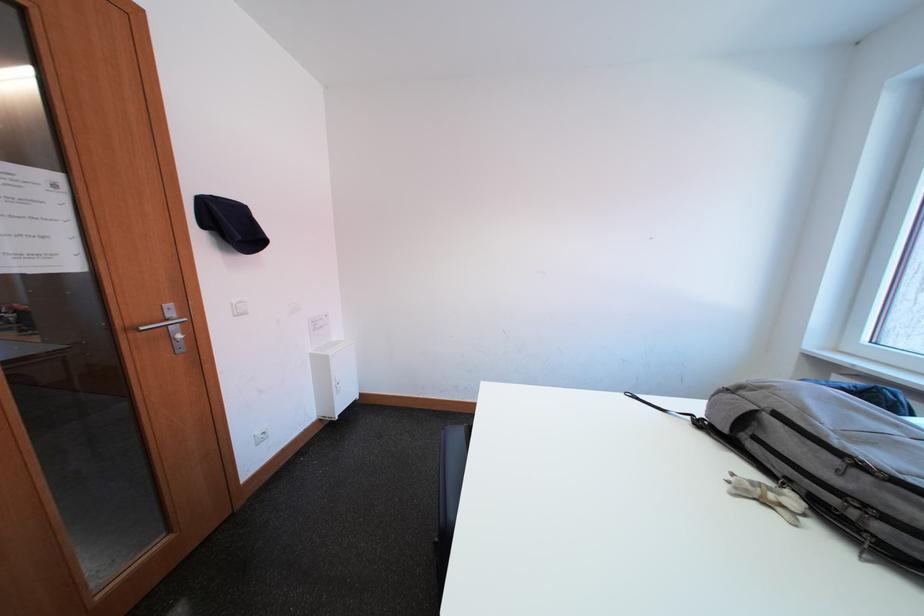
I want to click on silver door handle, so (163, 322).